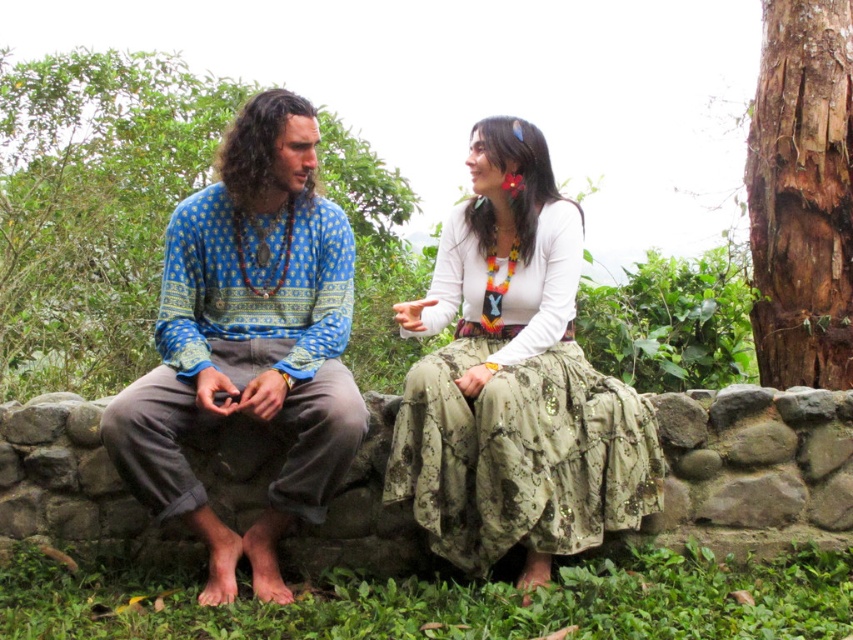
Is white cotton blouse at upper center below gray stone wall at center?

Incorrect, white cotton blouse at upper center is not positioned below gray stone wall at center.

Is point (480, 128) closer to camera compared to point (674, 461)?

That is True.

At what (x,y) coordinates should I click in order to perform the action: click on white cotton blouse at upper center. Please return your answer as a coordinate pair (x, y). The height and width of the screenshot is (640, 853). Looking at the image, I should click on [x=514, y=380].

Which is behind, point (366, 244) or point (811, 13)?

The point (366, 244) is more distant.

Is brown rough bark tree at left thinner than brown rough bark tree at upper right?

No, brown rough bark tree at left is not thinner than brown rough bark tree at upper right.

Is point (172, 81) behind point (830, 40)?

Yes, it is.

Find the location of a particular element. brown rough bark tree at left is located at coordinates (94, 208).

How distant is blue printed shirt at center from gray stone wall at center?

The distance of blue printed shirt at center from gray stone wall at center is 4.47 feet.

Which is below, blue printed shirt at center or gray stone wall at center?

Positioned lower is gray stone wall at center.

The width and height of the screenshot is (853, 640). Describe the element at coordinates (247, 342) in the screenshot. I see `blue printed shirt at center` at that location.

Identify the location of blue printed shirt at center. This screenshot has height=640, width=853. coord(247,342).